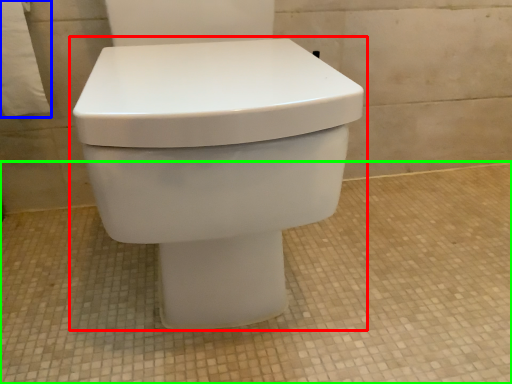
Question: Considering the real-world distances, which object is farthest from toilet (highlighted by a red box)? toilet paper (highlighted by a blue box) or concrete (highlighted by a green box)?

Choices:
 (A) toilet paper
 (B) concrete

Answer: (A)